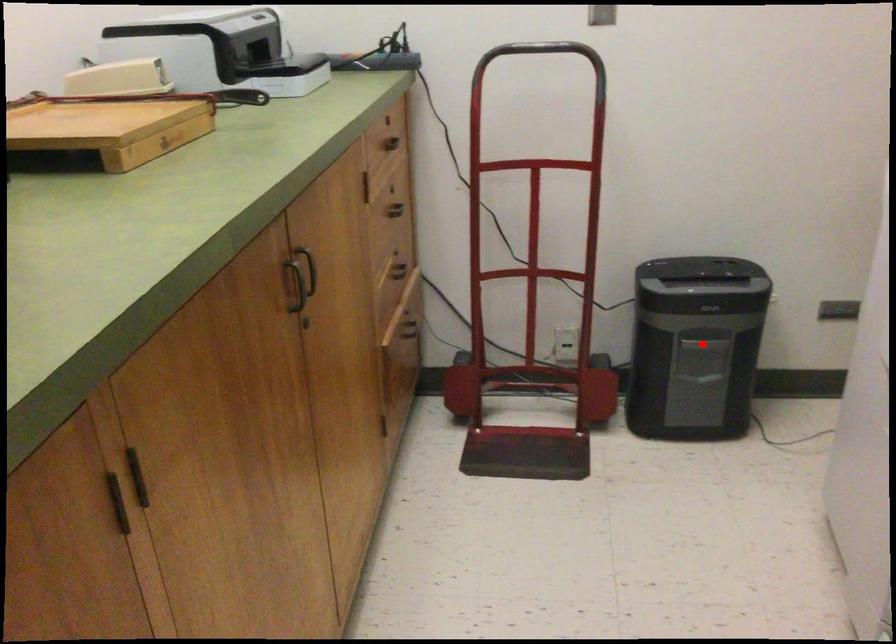
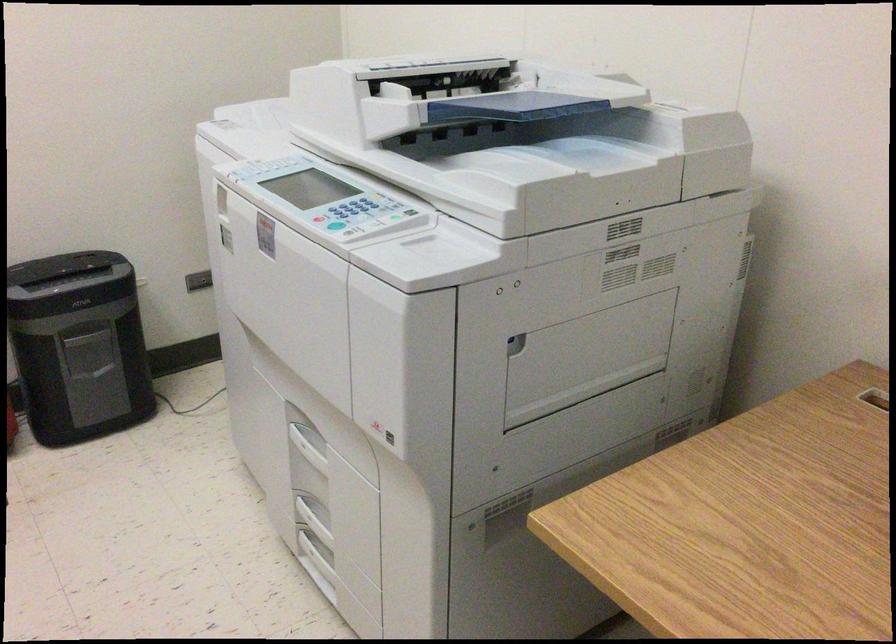
In the second image, find the point that corresponds to the highlighted location in the first image.

(79, 346)